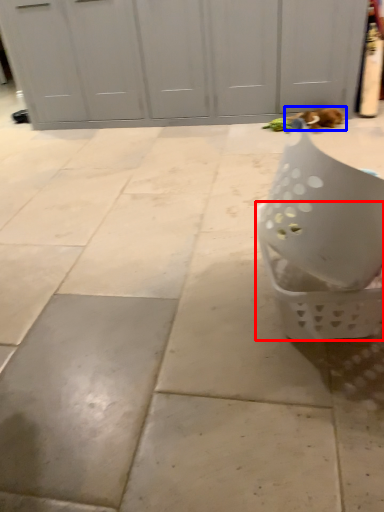
Question: Among these objects, which one is farthest to the camera, basket (highlighted by a red box) or cat (highlighted by a blue box)?

Choices:
 (A) basket
 (B) cat

Answer: (B)